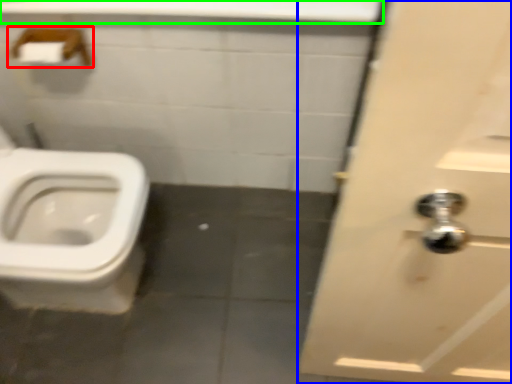
Question: Considering the real-world distances, which object is closest to towel bar (highlighted by a red box)? door (highlighted by a blue box) or counter top (highlighted by a green box).

Choices:
 (A) door
 (B) counter top

Answer: (B)